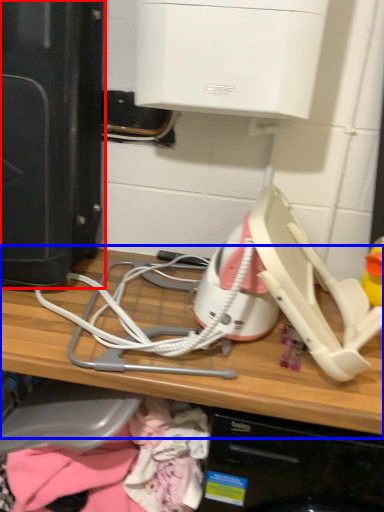
Question: Among these objects, which one is farthest to the camera, home appliance (highlighted by a red box) or computer (highlighted by a blue box)?

Choices:
 (A) home appliance
 (B) computer

Answer: (A)